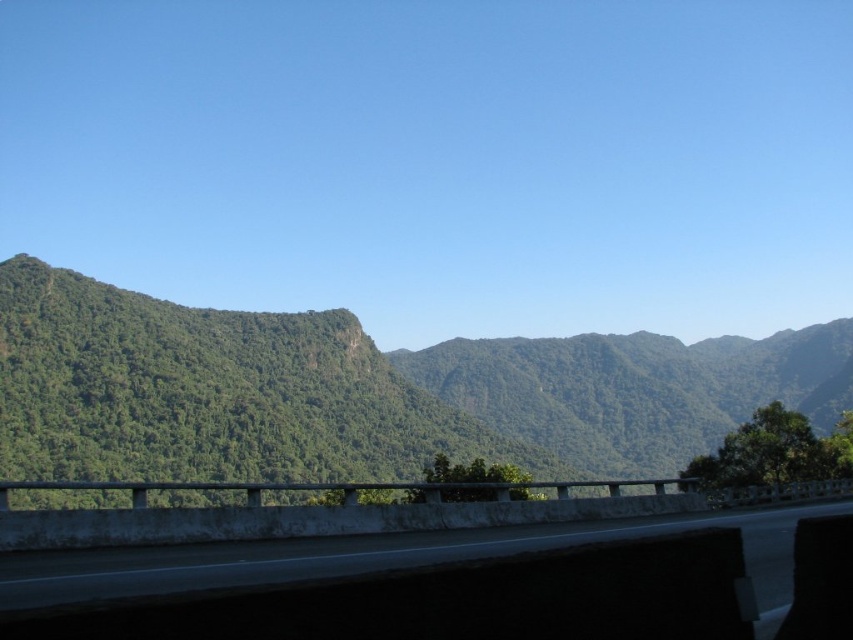
Question: Which point appears closest to the camera in this image?

Choices:
 (A) (422, 360)
 (B) (646, 561)

Answer: (B)

Question: Considering the relative positions of green leafy mountain at left and concrete at center in the image provided, where is green leafy mountain at left located with respect to concrete at center?

Choices:
 (A) above
 (B) below

Answer: (B)

Question: Is green leafy mountain at left smaller than concrete at center?

Choices:
 (A) no
 (B) yes

Answer: (A)

Question: Which point is farther from the camera taking this photo?

Choices:
 (A) (526, 618)
 (B) (310, 410)

Answer: (B)

Question: Can you confirm if green leafy mountain at left is thinner than concrete at center?

Choices:
 (A) yes
 (B) no

Answer: (B)